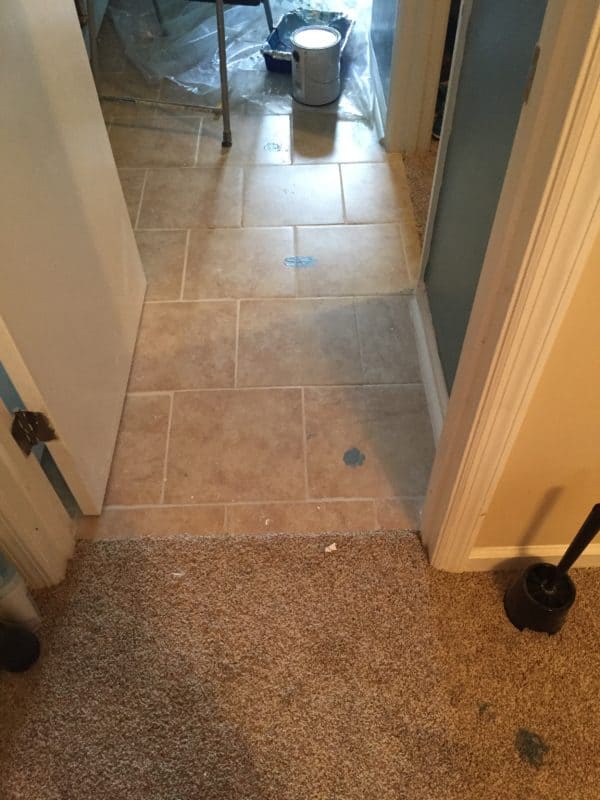
You are a GUI agent. You are given a task and a screenshot of the screen. Output one action in this format:
    pyautogui.click(x=<x>, y=<y>)
    Task: Click on the black stain on run lower right corner
    This screenshot has height=800, width=600.
    Given the screenshot: What is the action you would take?
    pyautogui.click(x=532, y=749)